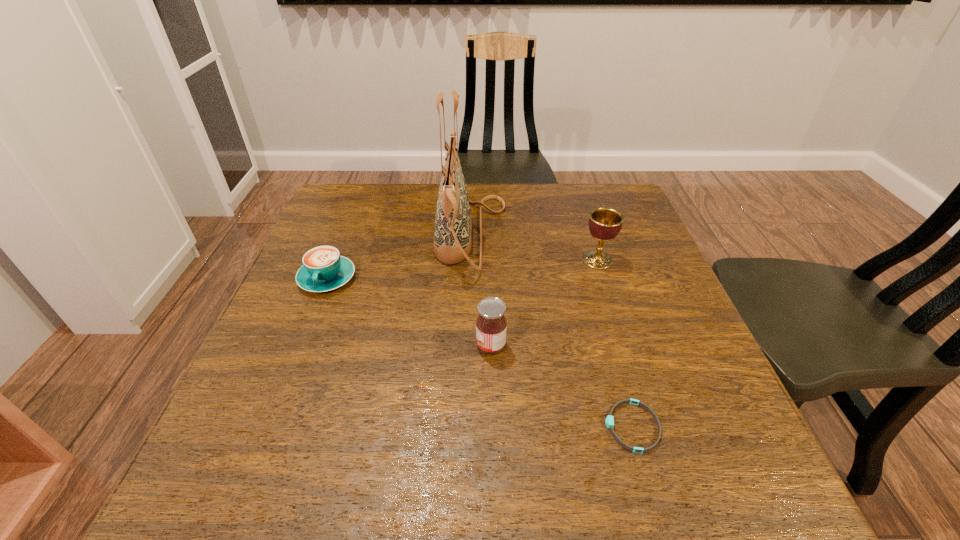
The image size is (960, 540). Find the location of `vacant region at the near right corner of the desktop`. vacant region at the near right corner of the desktop is located at coordinates (736, 455).

Identify the location of vacant space in between the chalice and the fourth tallest object. (463, 269).

Locate an element on the screen. This screenshot has width=960, height=540. empty space that is in between the shortest object and the chalice is located at coordinates (614, 343).

You are a GUI agent. You are given a task and a screenshot of the screen. Output one action in this format:
    pyautogui.click(x=<x>, y=<y>)
    Task: Click on the free spot between the chalice and the third tallest object
    Image resolution: width=960 pixels, height=540 pixels.
    Given the screenshot: What is the action you would take?
    pyautogui.click(x=544, y=303)

This screenshot has width=960, height=540. Identify the location of empty space that is in between the chalice and the nearest object. (614, 343).

Image resolution: width=960 pixels, height=540 pixels. I want to click on vacant area that lies between the nearest object and the leftmost object, so click(480, 353).

Where is `free spot between the jam and the nearest object`? free spot between the jam and the nearest object is located at coordinates click(562, 386).

I want to click on blank region between the jam and the handbag, so click(x=481, y=291).

This screenshot has height=540, width=960. What are the coordinates of `free space that is in between the third shortest object and the tallest object` in the screenshot? It's located at (481, 291).

The image size is (960, 540). I want to click on vacant area between the jam and the chalice, so click(544, 303).